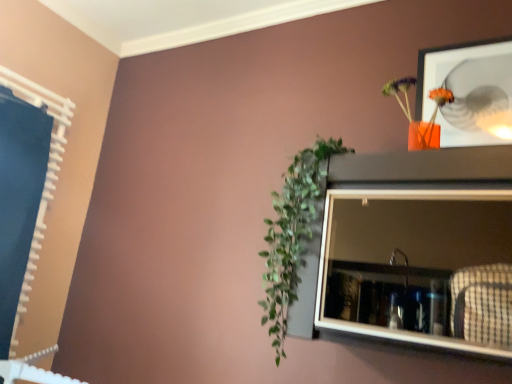
I want to click on green leafy plant at center-left, so click(x=293, y=234).

The image size is (512, 384). Find the location of `orange matte vase at upper right`. orange matte vase at upper right is located at coordinates pyautogui.click(x=419, y=121).

The height and width of the screenshot is (384, 512). What do you see at coordinates (419, 121) in the screenshot? I see `orange matte vase at upper right` at bounding box center [419, 121].

Find the location of a particular element. Image resolution: width=512 pixels, height=384 pixels. matte gray medicine cabinet at upper right is located at coordinates (419, 267).

From the picture: Is green leafy plant at center-left closer to camera compared to matte gray medicine cabinet at upper right?

That is False.

Could you tell me if green leafy plant at center-left is turned towards matte gray medicine cabinet at upper right?

Yes, green leafy plant at center-left is turned towards matte gray medicine cabinet at upper right.

Considering the points (285, 189) and (342, 227), which point is behind, point (285, 189) or point (342, 227)?

The point (342, 227) is farther from the camera.

Which of these two, green leafy plant at center-left or matte gray medicine cabinet at upper right, is bigger?

Bigger between the two is matte gray medicine cabinet at upper right.

Is green leafy plant at center-left surrounded by orange matte vase at upper right?

Actually, green leafy plant at center-left is outside orange matte vase at upper right.

Where is `floral arrangement on the right of green leafy plant at center-left`? The image size is (512, 384). floral arrangement on the right of green leafy plant at center-left is located at coordinates (419, 121).

Does orange matte vase at upper right turn towards green leafy plant at center-left?

No, orange matte vase at upper right is not aimed at green leafy plant at center-left.

Does orange matte vase at upper right appear on the left side of green leafy plant at center-left?

In fact, orange matte vase at upper right is to the right of green leafy plant at center-left.

Which object is wider, green leafy plant at center-left or orange matte vase at upper right?

Wider between the two is green leafy plant at center-left.

The height and width of the screenshot is (384, 512). I want to click on floral arrangement on the right of the green leafy plant at center-left, so [x=419, y=121].

Which is correct: green leafy plant at center-left is inside orange matte vase at upper right, or outside of it?

green leafy plant at center-left is located beyond the bounds of orange matte vase at upper right.

Looking at this image, is green leafy plant at center-left taller or shorter than orange matte vase at upper right?

Considering their sizes, green leafy plant at center-left has more height than orange matte vase at upper right.

Which object is positioned more to the right, orange matte vase at upper right or matte gray medicine cabinet at upper right?

orange matte vase at upper right is more to the right.

How distant is orange matte vase at upper right from matte gray medicine cabinet at upper right?

The distance of orange matte vase at upper right from matte gray medicine cabinet at upper right is 14.28 inches.

Does point (422, 124) lie behind point (400, 257)?

Yes, point (422, 124) is farther from viewer.

Could you tell me if orange matte vase at upper right is facing matte gray medicine cabinet at upper right?

No, orange matte vase at upper right is not oriented towards matte gray medicine cabinet at upper right.

Can you confirm if matte gray medicine cabinet at upper right is positioned to the left of green leafy plant at center-left?

In fact, matte gray medicine cabinet at upper right is to the right of green leafy plant at center-left.

Is matte gray medicine cabinet at upper right inside the boundaries of green leafy plant at center-left, or outside?

matte gray medicine cabinet at upper right is not inside green leafy plant at center-left, it's outside.

Between matte gray medicine cabinet at upper right and green leafy plant at center-left, which one has larger width?

matte gray medicine cabinet at upper right is wider.

Does matte gray medicine cabinet at upper right have a lesser height compared to green leafy plant at center-left?

Yes, matte gray medicine cabinet at upper right is shorter than green leafy plant at center-left.

Can you confirm if matte gray medicine cabinet at upper right is taller than orange matte vase at upper right?

Yes.

Does matte gray medicine cabinet at upper right turn towards orange matte vase at upper right?

No.

Is matte gray medicine cabinet at upper right not within orange matte vase at upper right?

Yes, matte gray medicine cabinet at upper right is not within orange matte vase at upper right.

At what (x,y) coordinates should I click in order to perform the action: click on medicine cabinet on the right of green leafy plant at center-left. Please return your answer as a coordinate pair (x, y). Looking at the image, I should click on (419, 267).

Locate an element on the screen. floral arrangement that appears above the green leafy plant at center-left (from a real-world perspective) is located at coordinates (419, 121).

Based on their spatial positions, is orange matte vase at upper right or matte gray medicine cabinet at upper right closer to green leafy plant at center-left?

matte gray medicine cabinet at upper right.

Looking at the image, which one is located closer to orange matte vase at upper right, matte gray medicine cabinet at upper right or green leafy plant at center-left?

matte gray medicine cabinet at upper right.

Looking at the image, which one is located closer to orange matte vase at upper right, green leafy plant at center-left or matte gray medicine cabinet at upper right?

Based on the image, matte gray medicine cabinet at upper right appears to be nearer to orange matte vase at upper right.

Based on their spatial positions, is matte gray medicine cabinet at upper right or orange matte vase at upper right closer to green leafy plant at center-left?

Based on the image, matte gray medicine cabinet at upper right appears to be nearer to green leafy plant at center-left.

When comparing their distances from matte gray medicine cabinet at upper right, does orange matte vase at upper right or green leafy plant at center-left seem further?

orange matte vase at upper right lies further to matte gray medicine cabinet at upper right than the other object.

Considering their positions, is green leafy plant at center-left positioned closer to matte gray medicine cabinet at upper right than orange matte vase at upper right?

green leafy plant at center-left is positioned closer to the anchor matte gray medicine cabinet at upper right.

I want to click on houseplant between orange matte vase at upper right and matte gray medicine cabinet at upper right in the up-down direction, so click(293, 234).